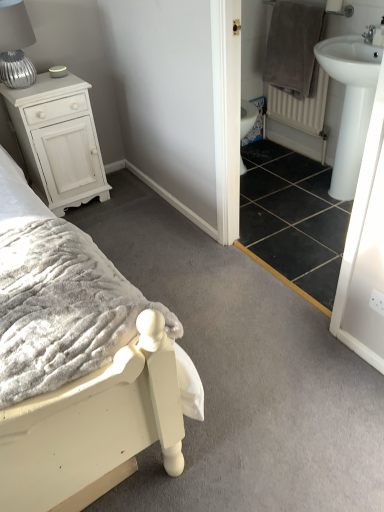
Question: From the image's perspective, is white glossy bidet at center under white textured bed at center?

Choices:
 (A) yes
 (B) no

Answer: (B)

Question: Does white glossy bidet at center have a greater height compared to white textured bed at center?

Choices:
 (A) yes
 (B) no

Answer: (B)

Question: Is white glossy bidet at center outside of white textured bed at center?

Choices:
 (A) no
 (B) yes

Answer: (B)

Question: Considering the relative sizes of white glossy bidet at center and white textured bed at center in the image provided, is white glossy bidet at center thinner than white textured bed at center?

Choices:
 (A) no
 (B) yes

Answer: (B)

Question: Can you confirm if white glossy bidet at center is wider than white textured bed at center?

Choices:
 (A) no
 (B) yes

Answer: (A)

Question: Considering the relative sizes of white glossy bidet at center and white textured bed at center in the image provided, is white glossy bidet at center shorter than white textured bed at center?

Choices:
 (A) no
 (B) yes

Answer: (B)

Question: From a real-world perspective, is white glossy bidet at center positioned over white textured radiator at right based on gravity?

Choices:
 (A) no
 (B) yes

Answer: (A)

Question: From the image's perspective, is white glossy bidet at center below white textured radiator at right?

Choices:
 (A) yes
 (B) no

Answer: (A)

Question: Considering the relative positions of white glossy bidet at center and white textured radiator at right in the image provided, is white glossy bidet at center to the left of white textured radiator at right from the viewer's perspective?

Choices:
 (A) no
 (B) yes

Answer: (B)

Question: Is white glossy bidet at center wider than white textured radiator at right?

Choices:
 (A) yes
 (B) no

Answer: (B)

Question: Considering the relative sizes of white glossy bidet at center and white textured radiator at right in the image provided, is white glossy bidet at center bigger than white textured radiator at right?

Choices:
 (A) no
 (B) yes

Answer: (A)

Question: From the image's perspective, is white glossy bidet at center on top of white textured radiator at right?

Choices:
 (A) no
 (B) yes

Answer: (A)

Question: Is white textured radiator at right at the right side of silver ribbed table lamp at left?

Choices:
 (A) no
 (B) yes

Answer: (B)